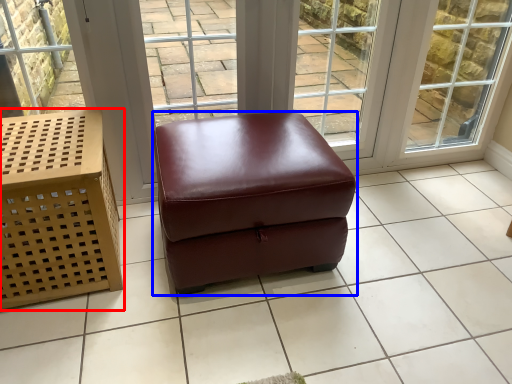
Question: Which point is closer to the camera, furniture (highlighted by a red box) or stool (highlighted by a blue box)?

Choices:
 (A) furniture
 (B) stool

Answer: (A)